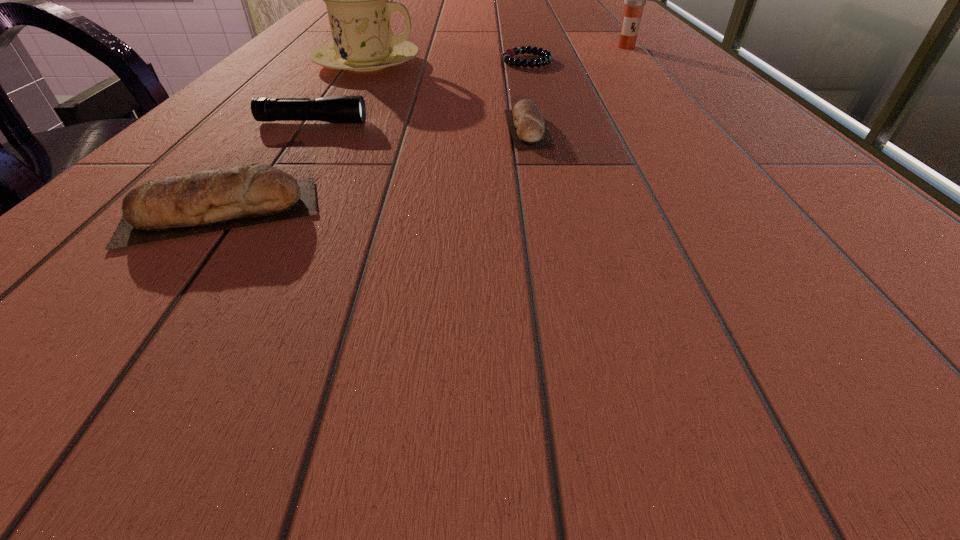
Find the location of a particular element. This screenshot has width=960, height=540. vacant region at the far edge of the desktop is located at coordinates (535, 8).

I want to click on vacant space at the near edge, so click(x=222, y=268).

Find the location of a particular element. The height and width of the screenshot is (540, 960). free point at the right edge is located at coordinates (674, 93).

Locate an element on the screen. The image size is (960, 540). vacant space at the near left corner of the desktop is located at coordinates (91, 233).

In the image, there is a desktop. Where is `vacant space at the far right corner`? vacant space at the far right corner is located at coordinates (586, 15).

Where is `vacant area between the chinaware and the left pita bread`? This screenshot has width=960, height=540. vacant area between the chinaware and the left pita bread is located at coordinates (294, 138).

Where is `vacant area between the rightmost object and the shorter pita bread`? vacant area between the rightmost object and the shorter pita bread is located at coordinates (577, 87).

Locate an element on the screen. free spot between the flashlight and the second shortest object is located at coordinates (420, 125).

I want to click on vacant space that's between the flashlight and the chinaware, so click(x=340, y=93).

Locate an element on the screen. The image size is (960, 540). free spot between the nearest object and the shorter pita bread is located at coordinates (374, 171).